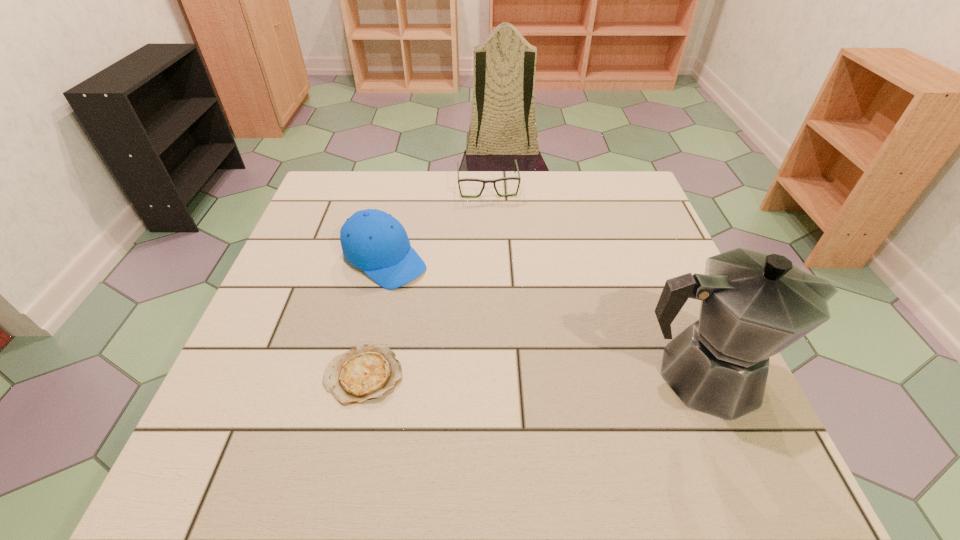
Locate an element on the screen. This screenshot has height=540, width=960. unoccupied area between the shortest object and the coffeepot is located at coordinates (533, 375).

I want to click on vacant region between the shortest object and the second shortest object, so click(x=426, y=281).

This screenshot has width=960, height=540. What are the coordinates of `free space between the tallest object and the third shortest object` in the screenshot? It's located at click(x=543, y=317).

Locate an element on the screen. The image size is (960, 540). free point between the tallest object and the spectacles is located at coordinates (595, 281).

This screenshot has width=960, height=540. I want to click on unoccupied area between the coffeepot and the shortest object, so click(x=533, y=375).

Image resolution: width=960 pixels, height=540 pixels. What are the coordinates of `free spot between the quiche and the spectacles` in the screenshot? It's located at (426, 281).

Where is `object that ranks as the second closest to the rightmost object`? object that ranks as the second closest to the rightmost object is located at coordinates (372, 240).

Identify which object is the third closest to the third object from left to right. Please provide its 2D coordinates. Your answer should be formatted as a tuple, i.e. [(x, y)], where the tuple contains the x and y coordinates of a point satisfying the conditions above.

[(365, 372)]

Find the location of a particular element. The height and width of the screenshot is (540, 960). free space in the image that satisfies the following two spatial constraints: 1. on the back side of the second farthest object; 2. on the left side of the spectacles is located at coordinates (402, 186).

At what (x,y) coordinates should I click in order to perform the action: click on vacant point that satisfies the following two spatial constraints: 1. on the front side of the coffeepot; 2. at the spout of the quiche. Please return your answer as a coordinate pair (x, y). Looking at the image, I should click on (364, 375).